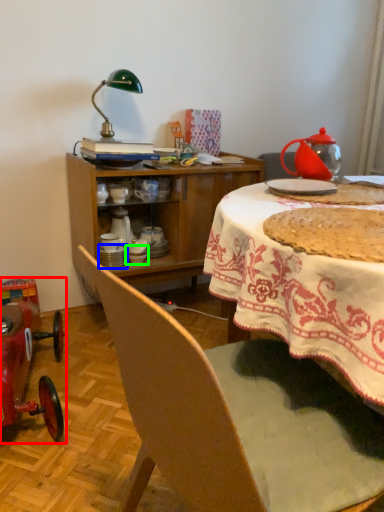
Question: Considering the real-world distances, which object is closest to model car (highlighted by a red box)? tableware (highlighted by a blue box) or tableware (highlighted by a green box).

Choices:
 (A) tableware
 (B) tableware

Answer: (A)